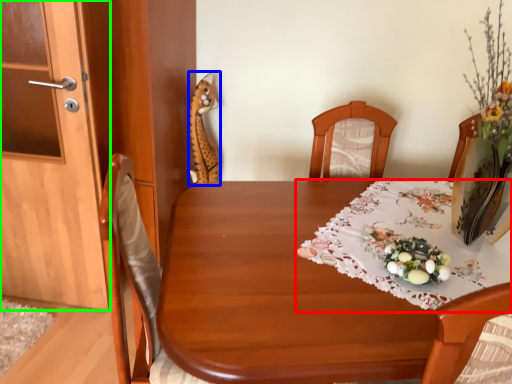
Question: Which object is the closest to the tablecloth (highlighted by a red box)? Choose among these: animal (highlighted by a blue box) or door (highlighted by a green box).

Choices:
 (A) animal
 (B) door

Answer: (B)